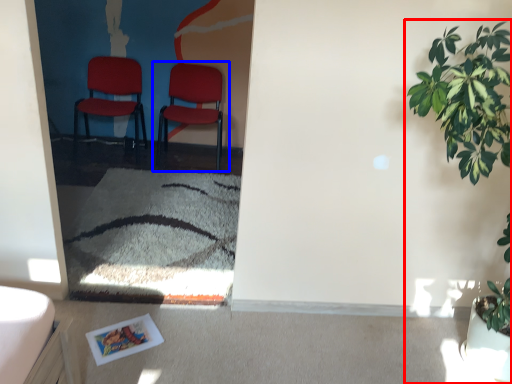
Question: Which point is closer to the camera, houseplant (highlighted by a red box) or chair (highlighted by a blue box)?

Choices:
 (A) houseplant
 (B) chair

Answer: (A)